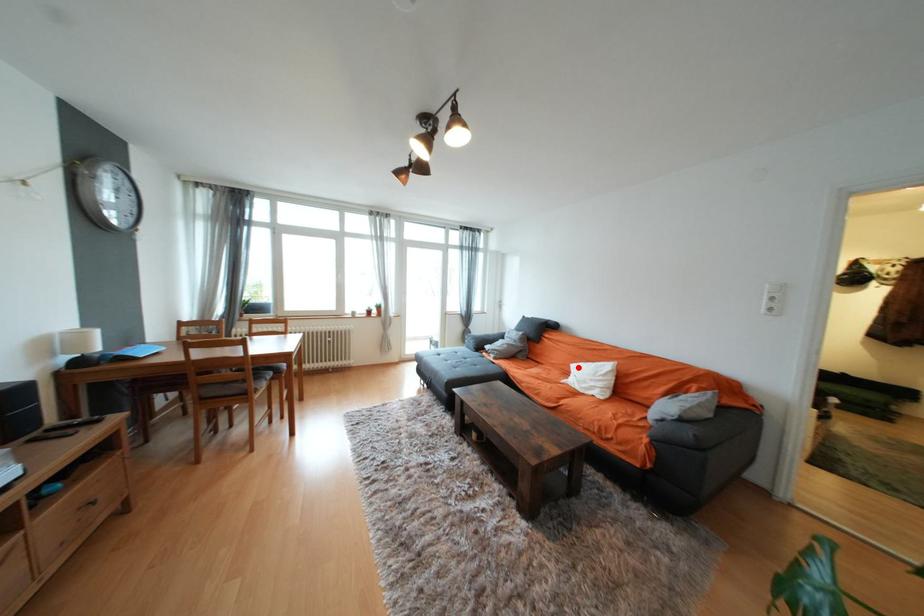
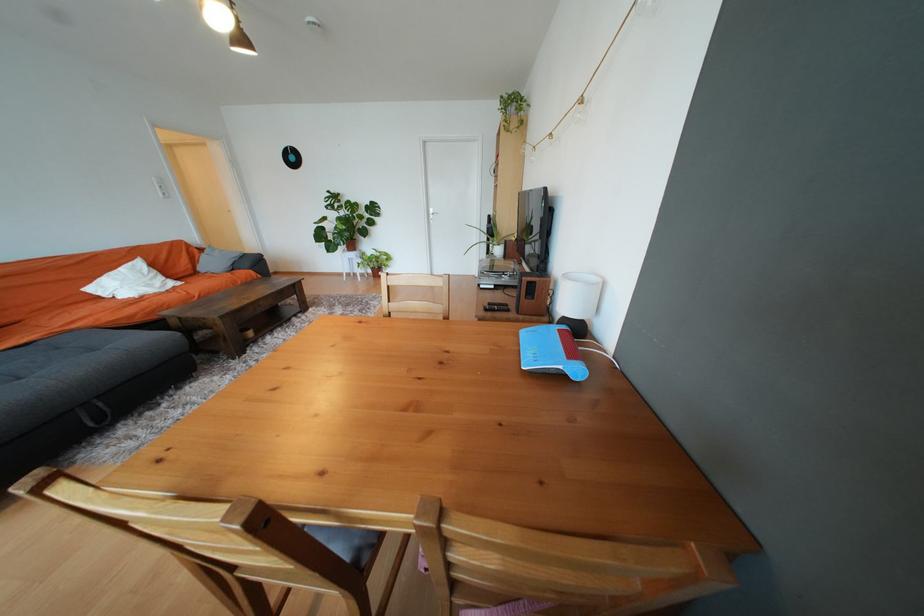
Where in the second image is the point corresponding to the highlighted location from the first image?

(96, 291)